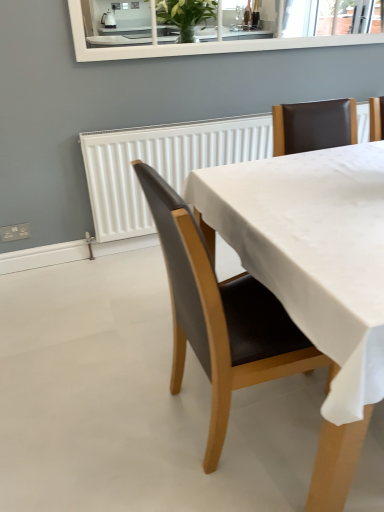
Question: Should I look upward or downward to see brown leather chair at center?

Choices:
 (A) down
 (B) up

Answer: (A)